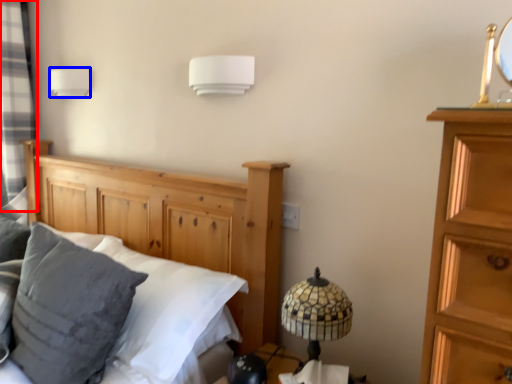
Question: Among these objects, which one is nearest to the camera, curtain (highlighted by a red box) or lamp (highlighted by a blue box)?

Choices:
 (A) curtain
 (B) lamp

Answer: (B)